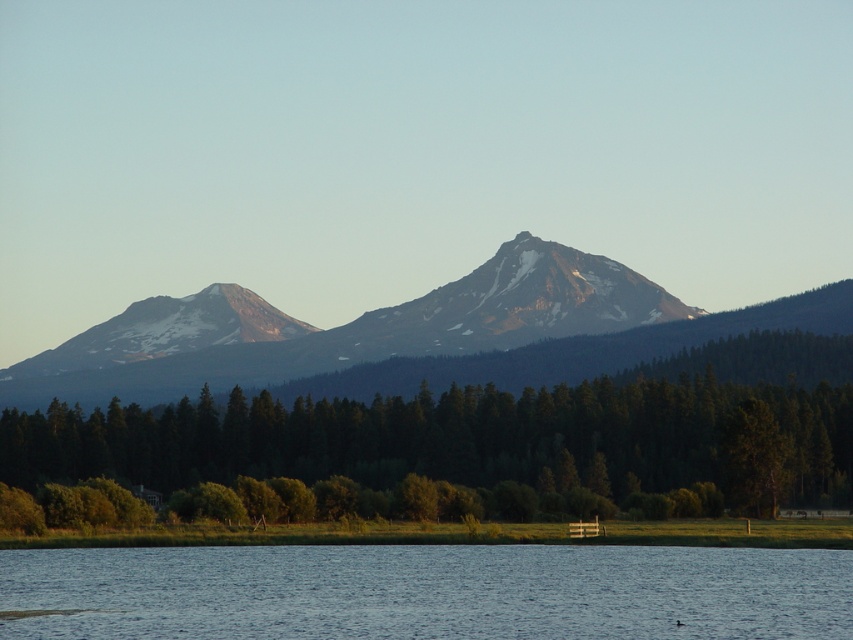
Which of these two, green matte tree at center or sandy brown rock at upper center, stands shorter?

green matte tree at center

Is point (653, 444) positioned after point (682, 337)?

No.

Is point (178, 484) positioned in front of point (447, 284)?

Yes, it is in front of point (447, 284).

The width and height of the screenshot is (853, 640). I want to click on green matte tree at center, so click(x=491, y=429).

Is blue water at lower center thinner than rocky gray mountain at center?

Yes.

Where is `blue water at lower center`? blue water at lower center is located at coordinates (425, 592).

Is green matte tree at center to the left of blue water at lower center from the viewer's perspective?

Yes, green matte tree at center is to the left of blue water at lower center.

Does green matte tree at center have a greater width compared to blue water at lower center?

Indeed, green matte tree at center has a greater width compared to blue water at lower center.

Which is in front, point (753, 396) or point (833, 557)?

Point (833, 557) is in front.

Locate an element on the screen. green matte tree at center is located at coordinates (491, 429).